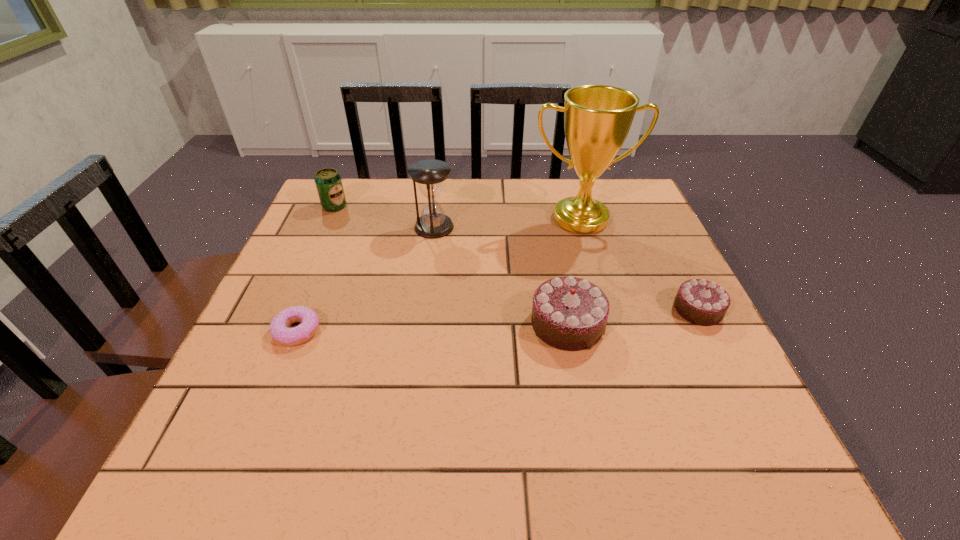
This screenshot has width=960, height=540. I want to click on free point that keeps the chocolate cakes evenly spaced on the left, so click(427, 339).